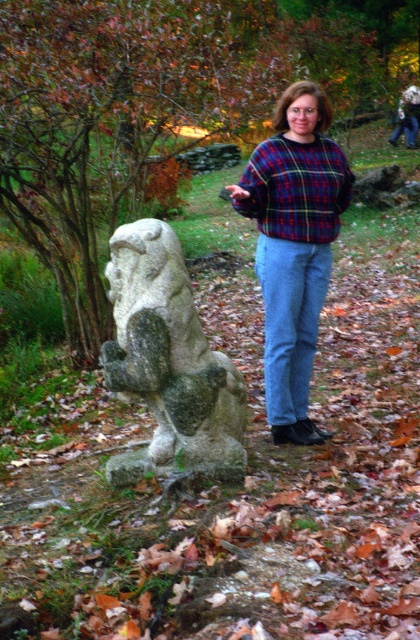
Question: Which point is closer to the camera?

Choices:
 (A) (275, 326)
 (B) (280, 177)

Answer: (B)

Question: Can you confirm if plaid sweater at center is positioned to the right of plaid fabric sweater at center?

Choices:
 (A) no
 (B) yes

Answer: (A)

Question: Can you confirm if gray stone statue at center is positioned to the right of denim jeans at center?

Choices:
 (A) yes
 (B) no

Answer: (B)

Question: Which is farther from the gray stone statue at center?

Choices:
 (A) plaid sweater at center
 (B) plaid fabric sweater at center
 (C) denim jeans at center

Answer: (B)

Question: Which object appears closest to the camera in this image?

Choices:
 (A) gray stone statue at center
 (B) plaid fabric sweater at center
 (C) denim jeans at center
 (D) plaid sweater at center

Answer: (A)

Question: Is gray stone statue at center positioned at the back of plaid sweater at center?

Choices:
 (A) yes
 (B) no

Answer: (B)